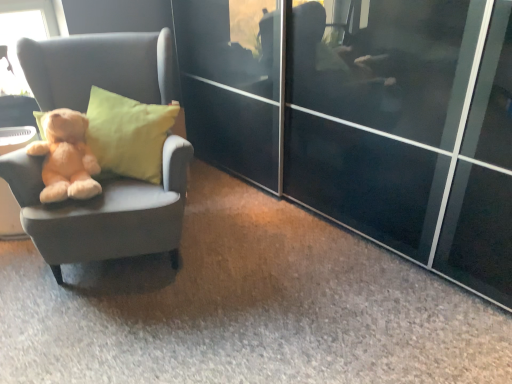
Image resolution: width=512 pixels, height=384 pixels. Identify the location of matte gray chair at left. (104, 212).

This screenshot has width=512, height=384. What do you see at coordinates (104, 212) in the screenshot?
I see `matte gray chair at left` at bounding box center [104, 212].

Locate an element on the screen. The width and height of the screenshot is (512, 384). soft plush teddy bear at left is located at coordinates (66, 157).

This screenshot has height=384, width=512. What do you see at coordinates (66, 157) in the screenshot?
I see `soft plush teddy bear at left` at bounding box center [66, 157].

Measure the distance between point (95, 160) and camera.

Point (95, 160) and camera are 6.56 feet apart from each other.

What are the coordinates of `matte gray chair at left` in the screenshot? It's located at (104, 212).

Which is more to the right, soft plush teddy bear at left or matte gray chair at left?

matte gray chair at left is more to the right.

In the image, is soft plush teddy bear at left positioned in front of or behind matte gray chair at left?

soft plush teddy bear at left is behind matte gray chair at left.

Considering the points (82, 189) and (82, 63), which point is in front, point (82, 189) or point (82, 63)?

Point (82, 189)

From the image's perspective, between soft plush teddy bear at left and matte gray chair at left, who is located below?

From the image's view, soft plush teddy bear at left is below.

From a real-world perspective, is soft plush teddy bear at left physically located above or below matte gray chair at left?

soft plush teddy bear at left is above matte gray chair at left.

Between soft plush teddy bear at left and matte gray chair at left, which one has smaller width?

soft plush teddy bear at left.

In the scene shown: Between soft plush teddy bear at left and matte gray chair at left, which one has more height?

matte gray chair at left.

Between soft plush teddy bear at left and matte gray chair at left, which one has larger size?

matte gray chair at left is bigger.

Is matte gray chair at left inside soft plush teddy bear at left?

Definitely not — matte gray chair at left is not inside soft plush teddy bear at left.

Would you say soft plush teddy bear at left is a long distance from matte gray chair at left?

Answer: No.

Is matte gray chair at left at the back of soft plush teddy bear at left?

Yes, soft plush teddy bear at left is facing away from matte gray chair at left.

How different are the orientations of soft plush teddy bear at left and matte gray chair at left in degrees?

The facing directions of soft plush teddy bear at left and matte gray chair at left are 8.16 degrees apart.

How distant is soft plush teddy bear at left from matte gray chair at left?

soft plush teddy bear at left and matte gray chair at left are 6.05 inches apart.

Identify the location of chair on the right side of soft plush teddy bear at left. (104, 212).

Based on the photo, is matte gray chair at left to the left of soft plush teddy bear at left from the viewer's perspective?

Incorrect, matte gray chair at left is not on the left side of soft plush teddy bear at left.

Which is behind, matte gray chair at left or soft plush teddy bear at left?

soft plush teddy bear at left is further from the camera.

Considering the positions of point (21, 58) and point (88, 193), is point (21, 58) closer or farther from the camera than point (88, 193)?

Point (21, 58) is farther from the camera than point (88, 193).

From the image's perspective, is matte gray chair at left located above or below soft plush teddy bear at left?

Clearly, from the image's perspective, matte gray chair at left is above soft plush teddy bear at left.

From a real-world perspective, which is physically above, matte gray chair at left or soft plush teddy bear at left?

In real-world perspective, soft plush teddy bear at left is above.

Which of these two, matte gray chair at left or soft plush teddy bear at left, is thinner?

With smaller width is soft plush teddy bear at left.

Does matte gray chair at left have a greater height compared to soft plush teddy bear at left?

Yes.

Considering the relative sizes of matte gray chair at left and soft plush teddy bear at left in the image provided, is matte gray chair at left smaller than soft plush teddy bear at left?

No, matte gray chair at left is not smaller than soft plush teddy bear at left.

From the picture: Is soft plush teddy bear at left located within matte gray chair at left?

Yes, soft plush teddy bear at left is inside matte gray chair at left.

Would you consider matte gray chair at left to be distant from soft plush teddy bear at left?

matte gray chair at left is actually quite close to soft plush teddy bear at left.

In the scene shown: Is matte gray chair at left aimed at soft plush teddy bear at left?

Yes.

What's the angular difference between matte gray chair at left and soft plush teddy bear at left's facing directions?

matte gray chair at left and soft plush teddy bear at left are facing 8.16 degrees away from each other.

At what (x,y) coordinates should I click in order to perform the action: click on chair below the soft plush teddy bear at left (from a real-world perspective). Please return your answer as a coordinate pair (x, y). Looking at the image, I should click on (104, 212).

Where is `teddy bear that is on the left side of matte gray chair at left`? The height and width of the screenshot is (384, 512). teddy bear that is on the left side of matte gray chair at left is located at coordinates (66, 157).

Identify the location of teddy bear located below the matte gray chair at left (from the image's perspective). Image resolution: width=512 pixels, height=384 pixels. (66, 157).